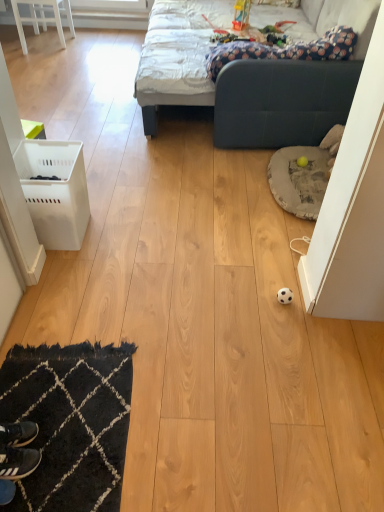
The width and height of the screenshot is (384, 512). In order to click on vacant point above black textured rug at lower left (from a real-world perspective) in this screenshot , I will do `click(66, 415)`.